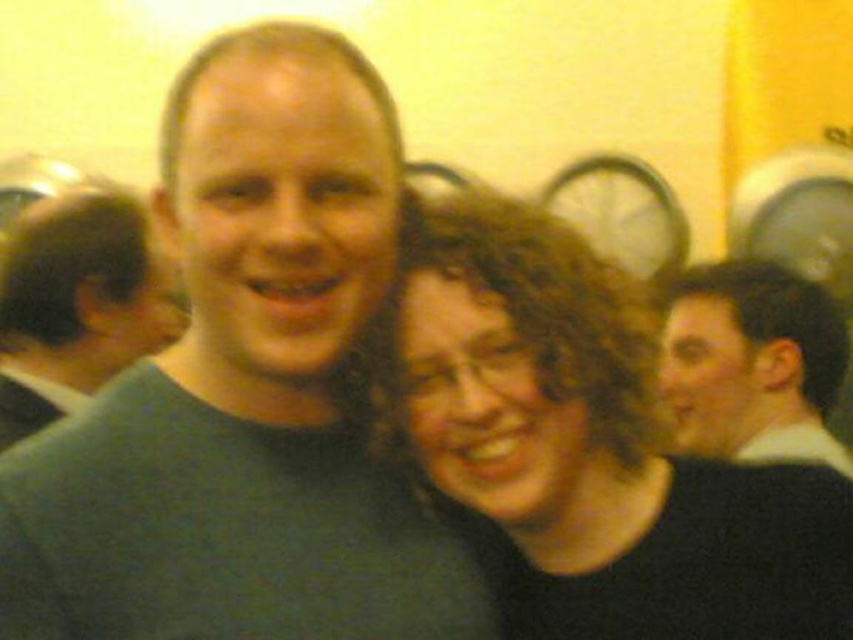
Is dark green sweater at left behind light brown hair at right?

Yes.

Which is behind, point (10, 333) or point (842, 352)?

Point (10, 333)

Does point (144, 244) come farther from viewer compared to point (761, 458)?

Yes, it is.

Locate an element on the screen. dark green sweater at left is located at coordinates (76, 305).

Does black matte hair at center have a lesser height compared to light brown hair at right?

In fact, black matte hair at center may be taller than light brown hair at right.

This screenshot has height=640, width=853. Identify the location of black matte hair at center. (584, 445).

How much distance is there between black matte hair at center and dark green sweater at left?

black matte hair at center and dark green sweater at left are 3.34 feet apart from each other.

Locate an element on the screen. black matte hair at center is located at coordinates (584, 445).